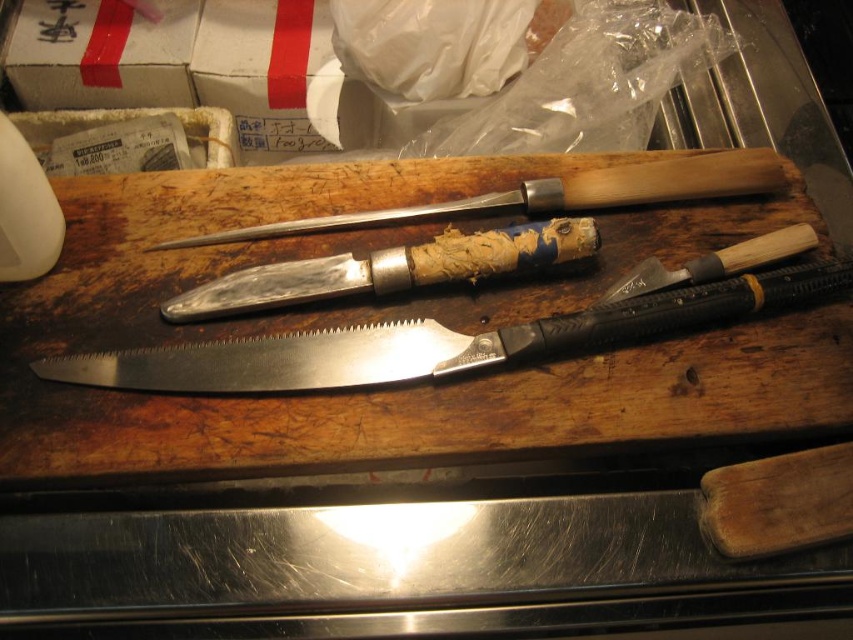
You are organizing tools in a workshop and see the metallic saw at center and the white cardboard box at upper left. Which object is closer to you?

The metallic saw at center is closer to you because it is positioned under the white cardboard box at upper left, indicating it is in front.

You are a chef preparing to cut vegetables and need to choose between the silver metallic knife at center and the polished silver knife at center. Considering their positions, which knife is closer to your hand if you are standing directly in front of the wooden surface?

The silver metallic knife at center is 3.55 inches away from the polished silver knife at center. Since you are standing directly in front of the wooden surface, the distance between them doesn not indicate which is closer to your hand. Additional information about their placement relative to your position is needed to determine proximity.

You are organizing knives on a wooden cutting board. You need to place a new knife exactly where the silver metallic knife at center was. According to the coordinates provided, where should you position the new knife?

The silver metallic knife at center was located at coordinates point (387,268), so you should position the new knife at the same coordinates to replace it.